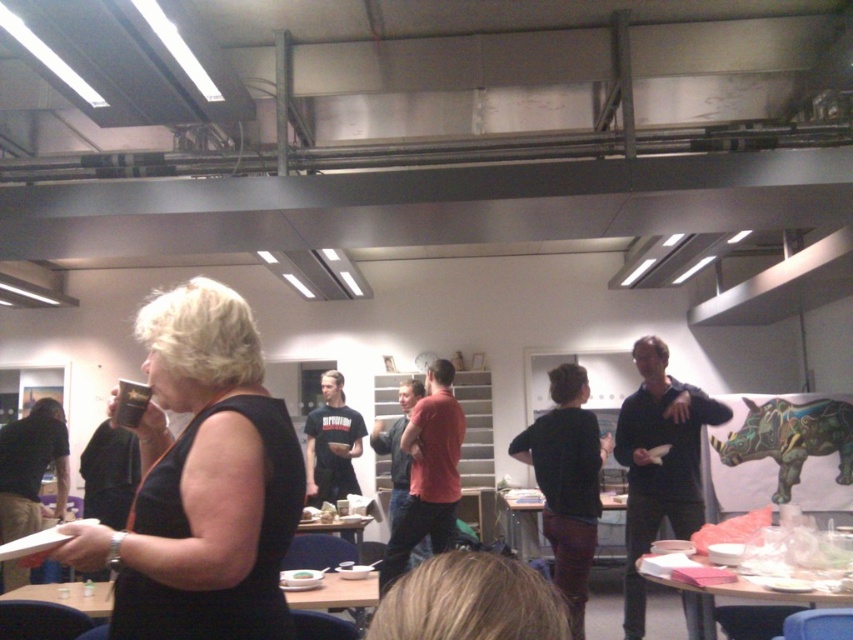
Between matte black dress at center and white matte plate at center, which one appears on the left side from the viewer's perspective?

white matte plate at center

Between point (132, 628) and point (309, 573), which one is positioned in front?

Positioned in front is point (132, 628).

Find the location of a particular element. This screenshot has height=640, width=853. matte black dress at center is located at coordinates (202, 483).